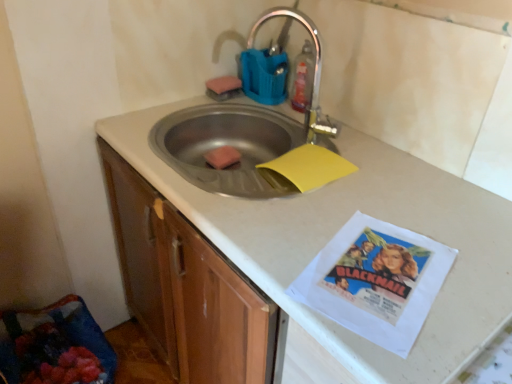
Locate an element on the screen. The width and height of the screenshot is (512, 384). empty space that is ontop of white matte countertop at center (from a real-world perspective) is located at coordinates (352, 164).